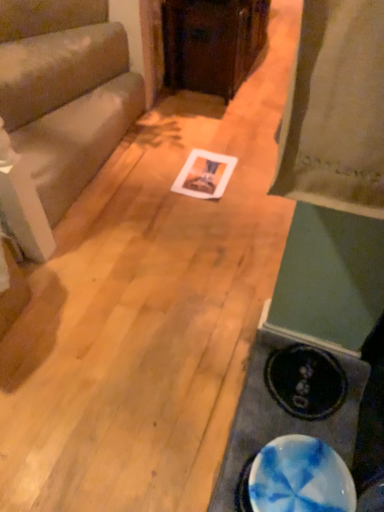
Describe the element at coordinates (300, 478) in the screenshot. I see `blue marbled plate at lower right` at that location.

This screenshot has height=512, width=384. I want to click on matte gray couch at left, which ranks as the second furniture in right-to-left order, so click(63, 99).

Find the location of a particular element. The image size is (384, 512). wooden cabinet at center, the second furniture in the left-to-right sequence is located at coordinates (212, 42).

Does point (295, 449) come in front of point (65, 93)?

Yes, point (295, 449) is closer to viewer.

Considering the sizes of objects blue marbled plate at lower right and matte gray couch at left, acting as the first furniture starting from the left, in the image provided, who is thinner, blue marbled plate at lower right or matte gray couch at left, acting as the first furniture starting from the left,?

Thinner between the two is blue marbled plate at lower right.

Based on the photo, is blue marbled plate at lower right not close to matte gray couch at left, which ranks as the 1th furniture in bottom-to-top order?

Yes.

From the image's perspective, is blue marbled plate at lower right located beneath matte gray couch at left, which ranks as the 1th furniture in bottom-to-top order?

Correct, blue marbled plate at lower right appears lower than matte gray couch at left, which ranks as the 1th furniture in bottom-to-top order, in the image.

Is blue marbled plate at lower right a part of wooden cabinet at center, which is the 1th furniture in right-to-left order?

No.

Is wooden cabinet at center, the first furniture positioned from the top, behind blue marbled plate at lower right?

Yes, it is behind blue marbled plate at lower right.

Locate an element on the screen. plate that appears below the wooden cabinet at center, positioned as the 2th furniture in bottom-to-top order (from the image's perspective) is located at coordinates (300, 478).

From the picture: From the image's perspective, does matte gray couch at left, which ranks as the second furniture in right-to-left order, appear higher than blue marbled plate at lower right?

Correct, matte gray couch at left, which ranks as the second furniture in right-to-left order, appears higher than blue marbled plate at lower right in the image.

Is matte gray couch at left, placed as the 2th furniture when sorted from top to bottom, positioned with its back to blue marbled plate at lower right?

That's not correct — matte gray couch at left, placed as the 2th furniture when sorted from top to bottom, is not looking away from blue marbled plate at lower right.

Is matte gray couch at left, placed as the 2th furniture when sorted from top to bottom, not near blue marbled plate at lower right?

That's right, there is a large distance between matte gray couch at left, placed as the 2th furniture when sorted from top to bottom, and blue marbled plate at lower right.

In the scene shown: Is matte gray couch at left, which ranks as the 1th furniture in bottom-to-top order, not inside blue marbled plate at lower right?

Yes.

Is wooden cabinet at center, the first furniture positioned from the top, aimed at blue marble table at lower right?

No, wooden cabinet at center, the first furniture positioned from the top, is not oriented towards blue marble table at lower right.

Which object is thinner, wooden cabinet at center, the second furniture in the left-to-right sequence, or blue marble table at lower right?

Thinner between the two is blue marble table at lower right.

Between wooden cabinet at center, the first furniture positioned from the top, and blue marble table at lower right, which one has smaller size?

blue marble table at lower right.

From a real-world perspective, which furniture is the 2nd one above the blue marble table at lower right? Please provide its 2D coordinates.

[(212, 42)]

Is wooden cabinet at center, the second furniture in the left-to-right sequence, aimed at matte gray couch at left, which ranks as the second furniture in right-to-left order?

No, wooden cabinet at center, the second furniture in the left-to-right sequence, is not oriented towards matte gray couch at left, which ranks as the second furniture in right-to-left order.

Consider the image. Which of these two, wooden cabinet at center, the first furniture positioned from the top, or matte gray couch at left, acting as the first furniture starting from the left, is bigger?

wooden cabinet at center, the first furniture positioned from the top.

Between wooden cabinet at center, positioned as the 2th furniture in bottom-to-top order, and matte gray couch at left, placed as the 2th furniture when sorted from top to bottom, which one appears on the right side from the viewer's perspective?

wooden cabinet at center, positioned as the 2th furniture in bottom-to-top order.

Can you confirm if wooden cabinet at center, positioned as the 2th furniture in bottom-to-top order, is taller than matte gray couch at left, which ranks as the 1th furniture in bottom-to-top order?

Correct, wooden cabinet at center, positioned as the 2th furniture in bottom-to-top order, is much taller as matte gray couch at left, which ranks as the 1th furniture in bottom-to-top order.

From a real-world perspective, between blue marbled plate at lower right and wooden cabinet at center, which is the 1th furniture in right-to-left order, who is vertically higher?

wooden cabinet at center, which is the 1th furniture in right-to-left order, is physically above.

Can you confirm if blue marbled plate at lower right is shorter than wooden cabinet at center, which is the 1th furniture in right-to-left order?

Correct, blue marbled plate at lower right is not as tall as wooden cabinet at center, which is the 1th furniture in right-to-left order.

Would you say blue marbled plate at lower right is a long distance from wooden cabinet at center, the second furniture in the left-to-right sequence?

Indeed, blue marbled plate at lower right is not near wooden cabinet at center, the second furniture in the left-to-right sequence.

Considering the positions of objects blue marbled plate at lower right and wooden cabinet at center, which is the 1th furniture in right-to-left order, in the image provided, who is in front, blue marbled plate at lower right or wooden cabinet at center, which is the 1th furniture in right-to-left order,?

blue marbled plate at lower right is closer to the camera.

From a real-world perspective, which object rests below the other?

blue marble table at lower right, from a real-world perspective.

Identify the location of table on the right of matte gray couch at left, which ranks as the second furniture in right-to-left order. [x=281, y=419].

Is matte gray couch at left, placed as the 2th furniture when sorted from top to bottom, bigger than blue marble table at lower right?

Yes, matte gray couch at left, placed as the 2th furniture when sorted from top to bottom, is bigger than blue marble table at lower right.

From the image's perspective, is matte gray couch at left, acting as the first furniture starting from the left, above or below blue marble table at lower right?

Based on their image positions, matte gray couch at left, acting as the first furniture starting from the left, is located above blue marble table at lower right.

The width and height of the screenshot is (384, 512). Identify the location of the 1st furniture located above the blue marbled plate at lower right (from a real-world perspective). (63, 99).

I want to click on plate that is in front of the wooden cabinet at center, positioned as the 2th furniture in bottom-to-top order, so click(x=300, y=478).

When comparing their distances from blue marble table at lower right, does blue marbled plate at lower right or wooden cabinet at center, which is the 1th furniture in right-to-left order, seem further?

wooden cabinet at center, which is the 1th furniture in right-to-left order, is further to blue marble table at lower right.

Estimate the real-world distances between objects in this image. Which object is further from blue marbled plate at lower right, blue marble table at lower right or matte gray couch at left, which ranks as the second furniture in right-to-left order?

Among the two, matte gray couch at left, which ranks as the second furniture in right-to-left order, is located further to blue marbled plate at lower right.

Which object lies nearer to the anchor point blue marbled plate at lower right, matte gray couch at left, which ranks as the second furniture in right-to-left order, or wooden cabinet at center, the second furniture in the left-to-right sequence?

matte gray couch at left, which ranks as the second furniture in right-to-left order, is closer to blue marbled plate at lower right.

Based on their spatial positions, is matte gray couch at left, which ranks as the 1th furniture in bottom-to-top order, or blue marble table at lower right closer to blue marbled plate at lower right?

blue marble table at lower right.

Which object lies nearer to the anchor point wooden cabinet at center, the first furniture positioned from the top, blue marbled plate at lower right or blue marble table at lower right?

blue marble table at lower right.

Which object lies further to the anchor point blue marble table at lower right, blue marbled plate at lower right or matte gray couch at left, placed as the 2th furniture when sorted from top to bottom?

Based on the image, matte gray couch at left, placed as the 2th furniture when sorted from top to bottom, appears to be further to blue marble table at lower right.

Which object lies further to the anchor point blue marble table at lower right, wooden cabinet at center, the second furniture in the left-to-right sequence, or blue marbled plate at lower right?

wooden cabinet at center, the second furniture in the left-to-right sequence, is further to blue marble table at lower right.

Which object lies nearer to the anchor point wooden cabinet at center, the second furniture in the left-to-right sequence, blue marble table at lower right or matte gray couch at left, which ranks as the second furniture in right-to-left order?

→ Based on the image, matte gray couch at left, which ranks as the second furniture in right-to-left order, appears to be nearer to wooden cabinet at center, the second furniture in the left-to-right sequence.

Where is `furniture between wooden cabinet at center, which is the 1th furniture in right-to-left order, and blue marbled plate at lower right vertically`? Image resolution: width=384 pixels, height=512 pixels. furniture between wooden cabinet at center, which is the 1th furniture in right-to-left order, and blue marbled plate at lower right vertically is located at coordinates (63, 99).

Identify the location of table between matte gray couch at left, placed as the 2th furniture when sorted from top to bottom, and blue marbled plate at lower right in the up-down direction. (281, 419).

I want to click on table between wooden cabinet at center, the second furniture in the left-to-right sequence, and blue marbled plate at lower right, in the vertical direction, so click(281, 419).

Locate an element on the screen. The height and width of the screenshot is (512, 384). furniture between wooden cabinet at center, positioned as the 2th furniture in bottom-to-top order, and blue marble table at lower right vertically is located at coordinates (63, 99).